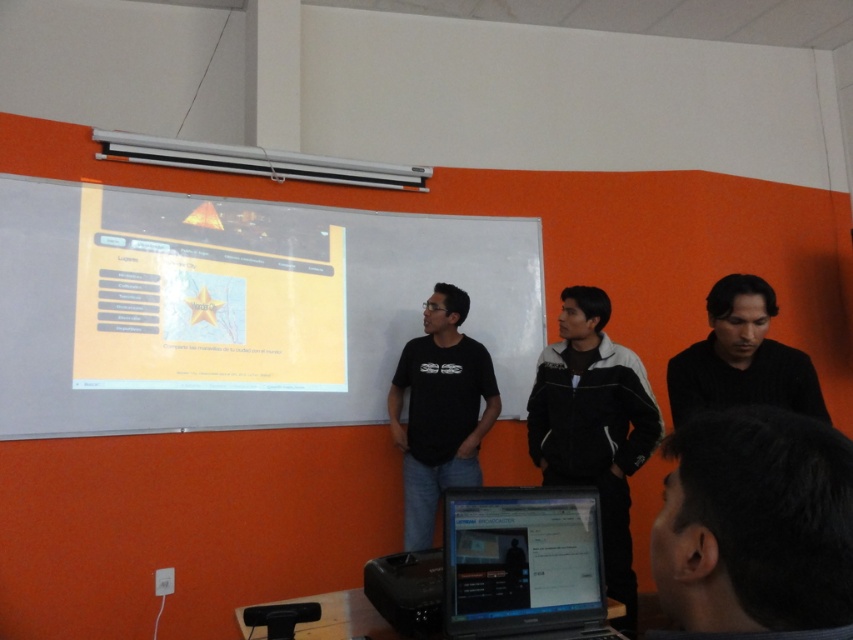
You are a student who needs to connect your black glossy laptop at center to the black plastic projector at lower center for a presentation. The cable you have is 8 inches long. Will the cable be sufficient?

The distance between the black glossy laptop at center and the black plastic projector at lower center is 8.73 inches. Since your cable is only 8 inches long, it will not be sufficient to connect them.

You are a photographer in the classroom and want to capture a photo of both the black and white jacket at center and the black matte shirt at center. Since you want to focus on the details of the jackets, which one should you zoom in on to ensure it appears larger in the photo?

The black and white jacket at center has a lesser width compared to the black matte shirt at center, so to focus on the details of the jackets, you should zoom in on the black and white jacket at center since it is smaller and needs more magnification to capture details.

Looking at this image, you are standing in the classroom facing the projector screen. There are two points marked on the screen at coordinates point (587,611) and point (390,602). Which point is closer to you?

Point (587,611) is further to the viewer than point (390,602), so the point closer to you is point (390,602).